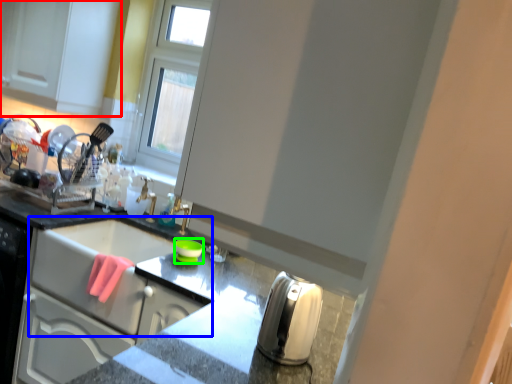
Question: Considering the real-world distances, which object is farthest from cabinetry (highlighted by a red box)? sink (highlighted by a blue box) or appliance (highlighted by a green box)?

Choices:
 (A) sink
 (B) appliance

Answer: (B)